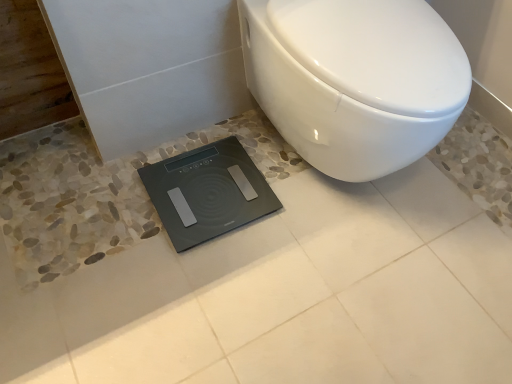
Identify the location of vacant area that is in front of black glass scale at lower center. This screenshot has width=512, height=384. (194, 289).